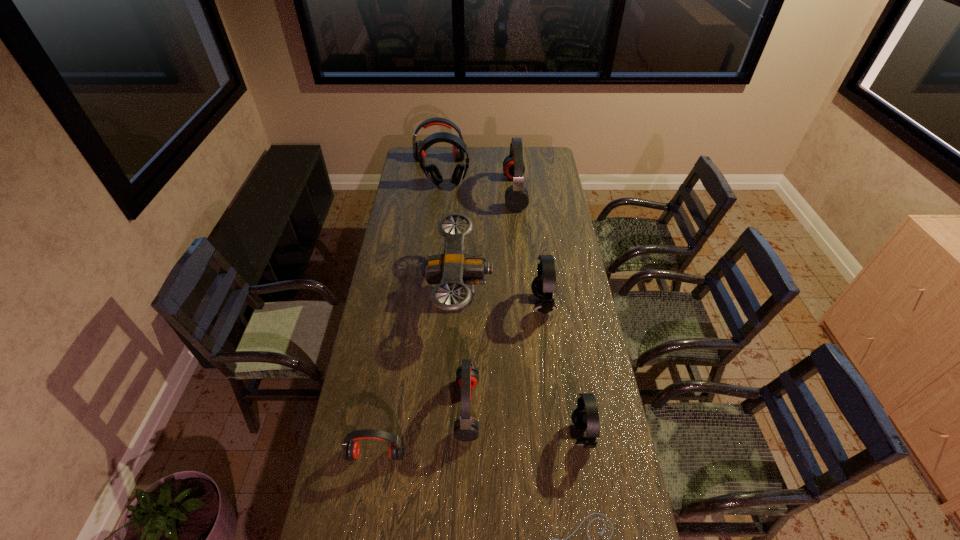
The height and width of the screenshot is (540, 960). What are the coordinates of `the second smallest red earphone` in the screenshot? It's located at (466, 428).

The height and width of the screenshot is (540, 960). I want to click on the nearest black earphone, so click(x=586, y=415).

Locate an element on the screen. This screenshot has height=540, width=960. the smallest red earphone is located at coordinates (351, 448).

The height and width of the screenshot is (540, 960). Identify the location of the nearest red earphone. (351, 448).

This screenshot has height=540, width=960. What are the coordinates of `vacant space located on the ear cups of the rightmost red earphone` in the screenshot? It's located at (465, 192).

At what (x,y) coordinates should I click in order to perform the action: click on free region located 0.180m on the ear cups of the rightmost red earphone. Please return your answer as a coordinate pair (x, y). Looking at the image, I should click on (470, 192).

I want to click on free region located 0.070m on the ear cups of the rightmost red earphone, so click(491, 192).

At what (x,y) coordinates should I click in order to perform the action: click on vacant space located 0.120m on the ear cups of the leftmost black earphone. Please return your answer as a coordinate pair (x, y). Looking at the image, I should click on (444, 204).

This screenshot has height=540, width=960. Find the location of `vacant space situated 0.390m on the ear cups of the third smallest red earphone`. vacant space situated 0.390m on the ear cups of the third smallest red earphone is located at coordinates (435, 202).

This screenshot has width=960, height=540. I want to click on vacant space located on the ear cups of the second smallest black earphone, so click(507, 304).